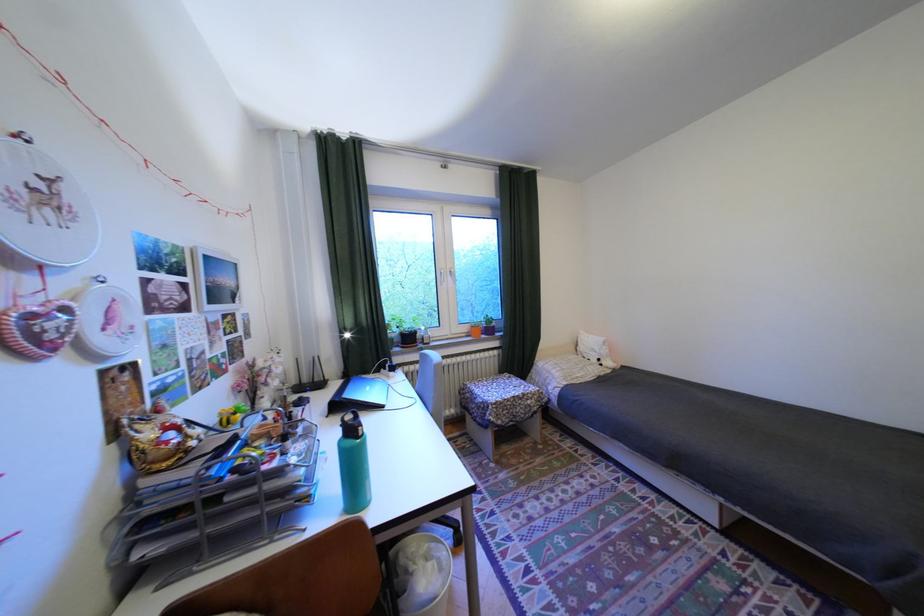
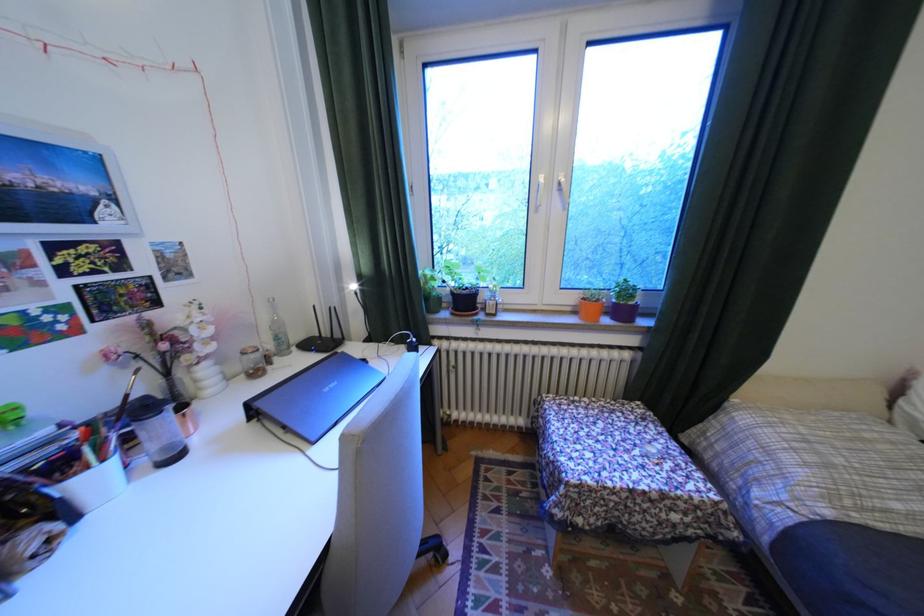
Where in the second image is the point corresponding to point 476,334 from the first image?

(580, 309)